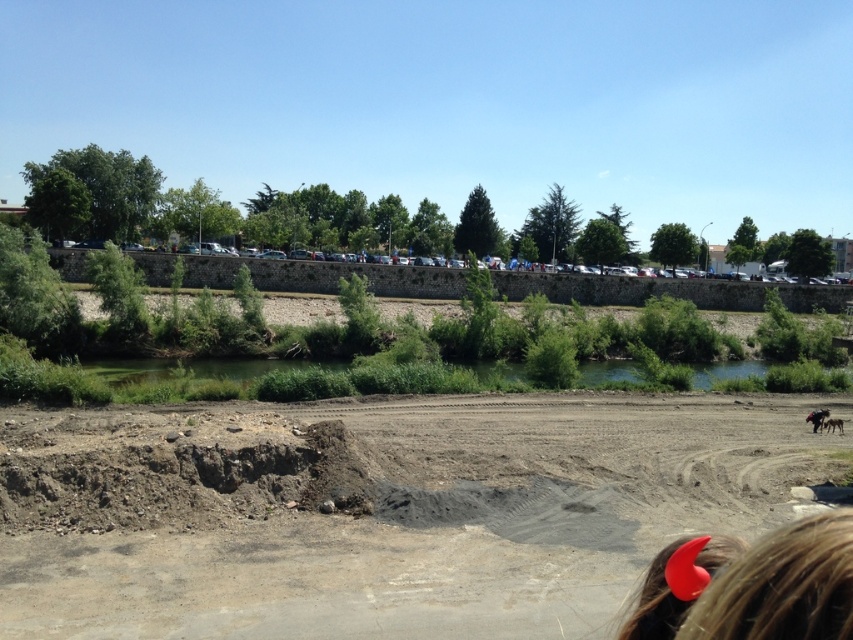
Between brown sandy dirt field at center and green grassy river at center, which one is positioned lower?

Positioned lower is green grassy river at center.

Between brown sandy dirt field at center and green grassy river at center, which one has less height?

brown sandy dirt field at center

Is point (384, 513) less distant than point (140, 364)?

Yes, it is in front of point (140, 364).

Locate an element on the screen. brown sandy dirt field at center is located at coordinates (416, 516).